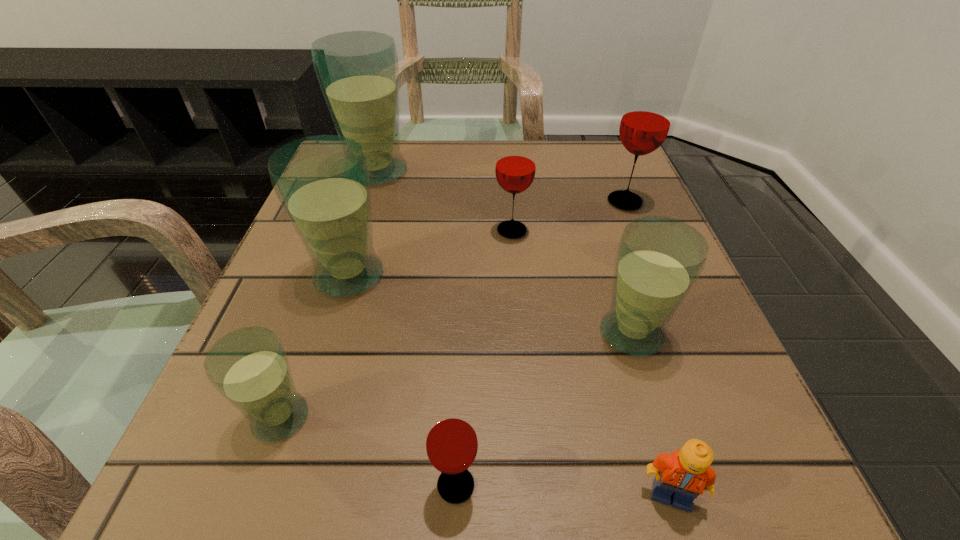
You are a GUI agent. You are given a task and a screenshot of the screen. Output one action in this format:
    pyautogui.click(x=<x>, y=<y>)
    Task: Click on the smallest blue glass
    The image size is (960, 540).
    Given the screenshot: What is the action you would take?
    pyautogui.click(x=249, y=367)

What are the coordinates of `the nearest blue glass` in the screenshot? It's located at (249, 367).

Identify the location of the leftmost red glass. (451, 442).

Identify the location of the nearest red glass. (451, 442).

The height and width of the screenshot is (540, 960). I want to click on Lego, so click(685, 474).

Find the location of a particular element. This screenshot has height=540, width=960. the shortest object is located at coordinates (685, 474).

Where is `free spot located 0.190m on the right of the tallest object`? The image size is (960, 540). free spot located 0.190m on the right of the tallest object is located at coordinates [x=495, y=172].

Locate an element on the screen. This screenshot has height=540, width=960. free space located on the back of the farthest red glass is located at coordinates (613, 175).

Identify the location of free space located 0.270m on the front of the fourth farthest object. This screenshot has height=540, width=960. (287, 475).

I want to click on free space located on the front of the second nearest red glass, so click(x=524, y=383).